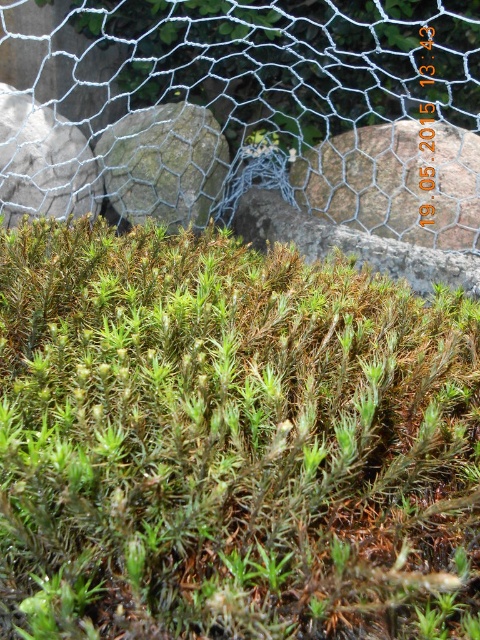
You are a gardener trying to determine the best way to remove the gray rough stone at center without damaging the wire mesh at upper center. What should you consider about their positions?

The wire mesh at upper center is in front of the gray rough stone at center, so you should be cautious not to move the wire mesh when removing the stone.

You are a gardener examining the dense moss patch. You notice the green fuzzy moss at center and the gray rough stone at center. Which object is located below the other?

The green fuzzy moss at center is positioned under gray rough stone at center, so the moss is below the stone.